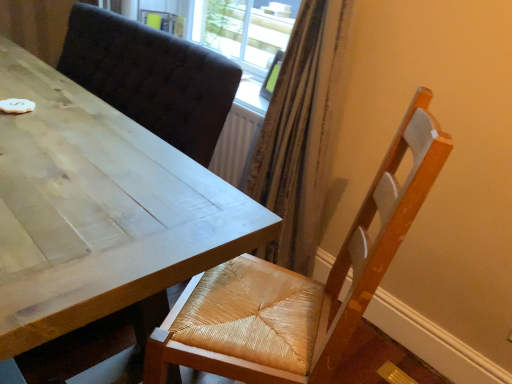
Question: Is woven wood chair at lower right surrounded by light wood table at upper left?

Choices:
 (A) yes
 (B) no

Answer: (B)

Question: Can you confirm if light wood table at upper left is positioned to the right of woven wood chair at lower right?

Choices:
 (A) no
 (B) yes

Answer: (A)

Question: Does light wood table at upper left appear on the left side of woven wood chair at lower right?

Choices:
 (A) yes
 (B) no

Answer: (A)

Question: Does light wood table at upper left have a greater height compared to woven wood chair at lower right?

Choices:
 (A) yes
 (B) no

Answer: (B)

Question: From the image's perspective, is light wood table at upper left beneath woven wood chair at lower right?

Choices:
 (A) no
 (B) yes

Answer: (A)

Question: From a real-world perspective, is light wood table at upper left located higher than woven wood chair at lower right?

Choices:
 (A) no
 (B) yes

Answer: (A)

Question: From the image's perspective, is woven wood chair at lower right below light wood table at upper left?

Choices:
 (A) no
 (B) yes

Answer: (B)

Question: Does woven wood chair at lower right have a greater height compared to light wood table at upper left?

Choices:
 (A) yes
 (B) no

Answer: (A)

Question: Considering the relative sizes of woven wood chair at lower right and light wood table at upper left in the image provided, is woven wood chair at lower right thinner than light wood table at upper left?

Choices:
 (A) no
 (B) yes

Answer: (A)

Question: Does woven wood chair at lower right appear on the right side of light wood table at upper left?

Choices:
 (A) yes
 (B) no

Answer: (A)

Question: Is woven wood chair at lower right oriented away from light wood table at upper left?

Choices:
 (A) no
 (B) yes

Answer: (A)

Question: From a real-world perspective, is woven wood chair at lower right over light wood table at upper left?

Choices:
 (A) yes
 (B) no

Answer: (A)

Question: Is point (77, 221) closer or farther from the camera than point (365, 279)?

Choices:
 (A) closer
 (B) farther

Answer: (B)